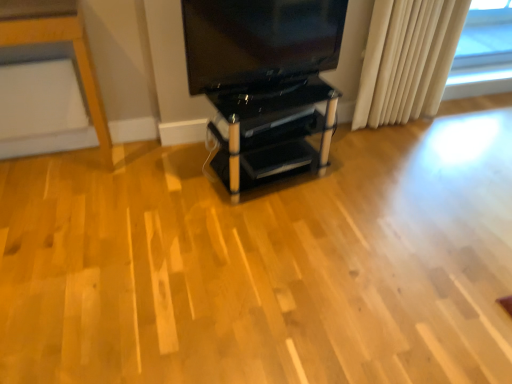
Question: Does matte black tv at upper center come in front of white fabric curtain at right?

Choices:
 (A) yes
 (B) no

Answer: (A)

Question: Would you say matte black tv at upper center is outside white fabric curtain at right?

Choices:
 (A) no
 (B) yes

Answer: (B)

Question: Does matte black tv at upper center have a lesser width compared to white fabric curtain at right?

Choices:
 (A) yes
 (B) no

Answer: (A)

Question: From the image's perspective, is matte black tv at upper center beneath white fabric curtain at right?

Choices:
 (A) yes
 (B) no

Answer: (A)

Question: Is matte black tv at upper center positioned far away from white fabric curtain at right?

Choices:
 (A) no
 (B) yes

Answer: (A)

Question: Is matte black tv at upper center touching white fabric curtain at right?

Choices:
 (A) no
 (B) yes

Answer: (A)

Question: Is matte black tv at upper center next to black glass shelving unit at center?

Choices:
 (A) yes
 (B) no

Answer: (B)

Question: From the image's perspective, would you say matte black tv at upper center is shown under black glass shelving unit at center?

Choices:
 (A) yes
 (B) no

Answer: (B)

Question: Is matte black tv at upper center not within black glass shelving unit at center?

Choices:
 (A) yes
 (B) no

Answer: (A)

Question: Is black glass shelving unit at center at the back of matte black tv at upper center?

Choices:
 (A) yes
 (B) no

Answer: (B)

Question: Is black glass shelving unit at center a part of matte black tv at upper center?

Choices:
 (A) no
 (B) yes

Answer: (A)

Question: Could you tell me if matte black tv at upper center is turned towards black glass shelving unit at center?

Choices:
 (A) no
 (B) yes

Answer: (A)

Question: Is white fabric curtain at right behind black glass shelving unit at center?

Choices:
 (A) yes
 (B) no

Answer: (A)